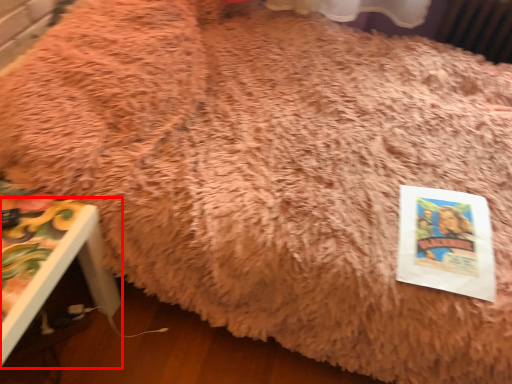
Question: From the image, what is the correct spatial relationship of furniture (annotated by the red box) in relation to paperback book?

Choices:
 (A) left
 (B) right

Answer: (A)